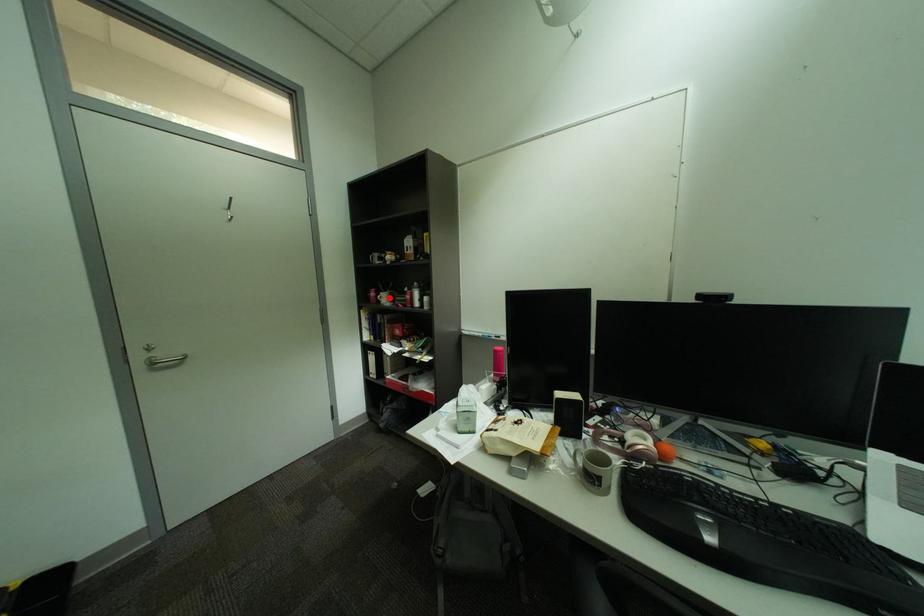
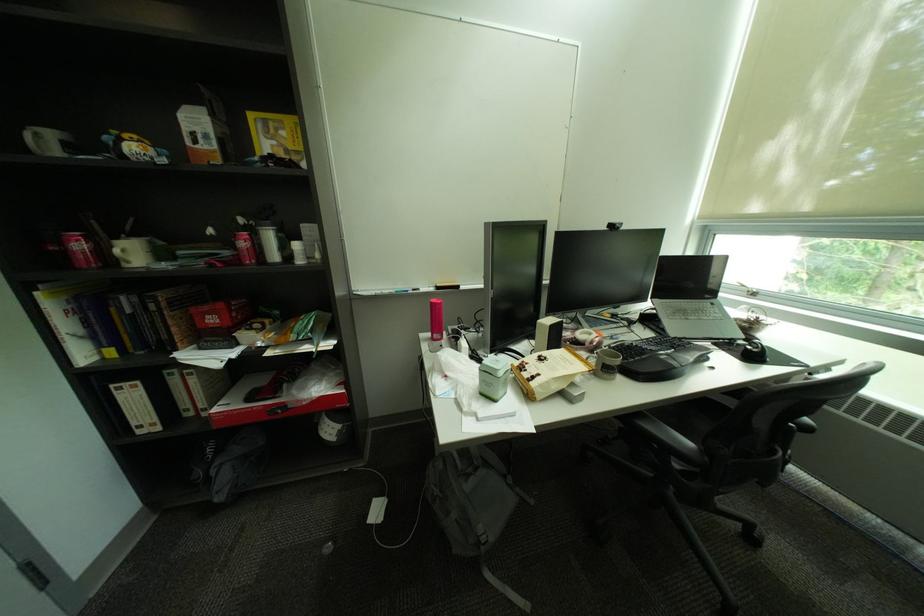
In the second image, find the point that corresponds to the highlighted location in the first image.

(128, 252)